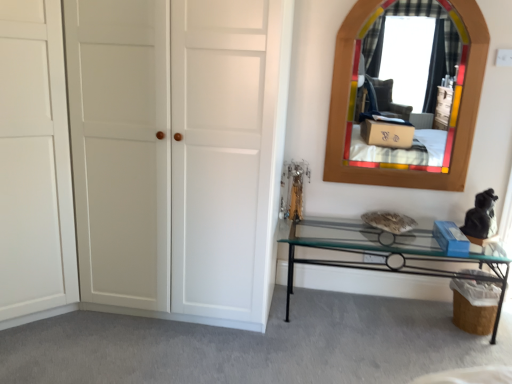
Question: Is clear glass table at lower right bigger or smaller than white matte door at left, which is counted as the 2th door, starting from the left?

Choices:
 (A) big
 (B) small

Answer: (B)

Question: Looking at their shapes, would you say clear glass table at lower right is wider or thinner than white matte door at left, which is counted as the 2th door, starting from the left?

Choices:
 (A) thin
 (B) wide

Answer: (A)

Question: Which object is the farthest from the white matte door at left, which is counted as the 2th door, starting from the left?

Choices:
 (A) wooden stained mirror at upper right
 (B) clear glass table at lower right
 (C) white matte door at left, the second door viewed from the right

Answer: (A)

Question: Considering the real-world distances, which object is farthest from the white matte door at left, the second door viewed from the right?

Choices:
 (A) wooden stained mirror at upper right
 (B) clear glass table at lower right
 (C) white matte door at left, which is counted as the 2th door, starting from the left

Answer: (A)